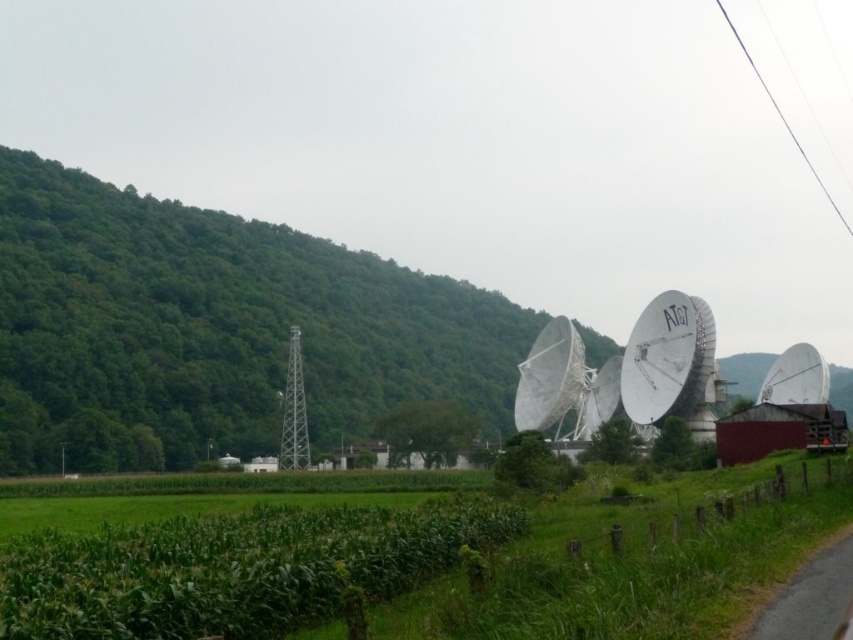
Question: Which object is positioned farthest from the green leafy corn at lower left?

Choices:
 (A) green grassy corn field at center
 (B) white metallic satellite at center

Answer: (B)

Question: Which point appears closest to the camera in this image?

Choices:
 (A) (22, 616)
 (B) (550, 618)

Answer: (B)

Question: Does green grassy corn field at center have a smaller size compared to white metallic satellite at center?

Choices:
 (A) no
 (B) yes

Answer: (A)

Question: Which of these objects is positioned closest to the green grassy corn field at center?

Choices:
 (A) white metallic satellite at center
 (B) green leafy corn at lower left

Answer: (B)

Question: Where is green leafy corn at lower left located in relation to white metallic satellite at center in the image?

Choices:
 (A) right
 (B) left

Answer: (B)

Question: Is green leafy corn at lower left further to the viewer compared to white metallic satellite at center?

Choices:
 (A) yes
 (B) no

Answer: (B)